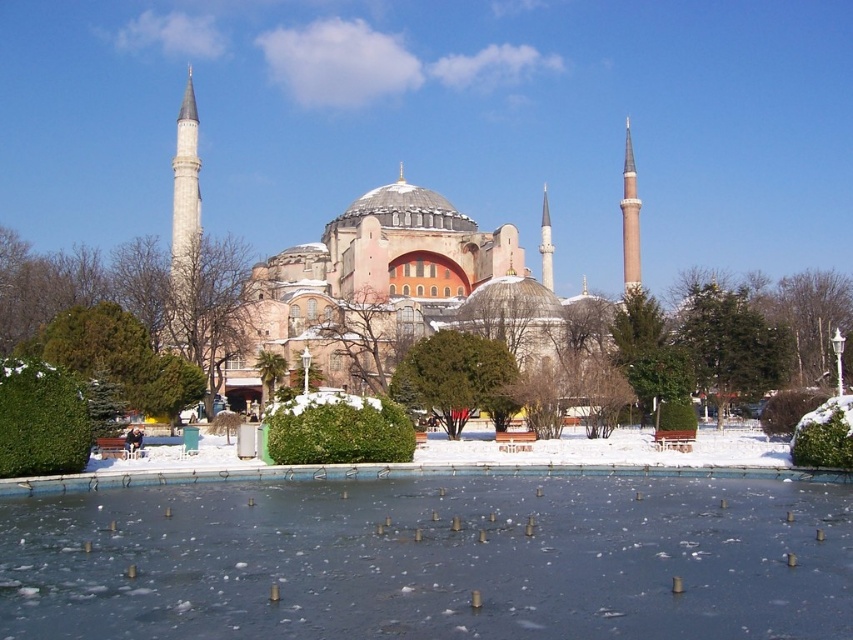
From the picture: You are a photographer planning to capture the frozen glass lake at center and the smooth white minaret at center in a single shot. Given that your camera has a fixed focal length, which object should you prioritize positioning closer to the camera to ensure both fit within the frame?

Since the frozen glass lake at center is wider than the smooth white minaret at center, you should prioritize positioning the frozen glass lake at center closer to the camera to ensure both fit within the frame.

You are standing in front of the mosque and want to take a photo of both the brown stone minaret at right and the smooth white minaret at center. Which minaret should you position to the right side of your camera frame to include both in the shot?

You should position the brown stone minaret at right to the right side of your camera frame since it is already located to the right of the smooth white minaret at center.

You are a drone operator tasked with capturing aerial footage of the mosque. Your drone has a maximum flight range of 60 feet from its starting position. If you position the drone at the base of the brown stone minaret at right, can it reach the smooth white minaret at center without exceeding its range?

The distance between the brown stone minaret at right and the smooth white minaret at center is 64.13 feet. Since the drone has a maximum flight range of 60 feet, it cannot reach the smooth white minaret at center without exceeding its range.